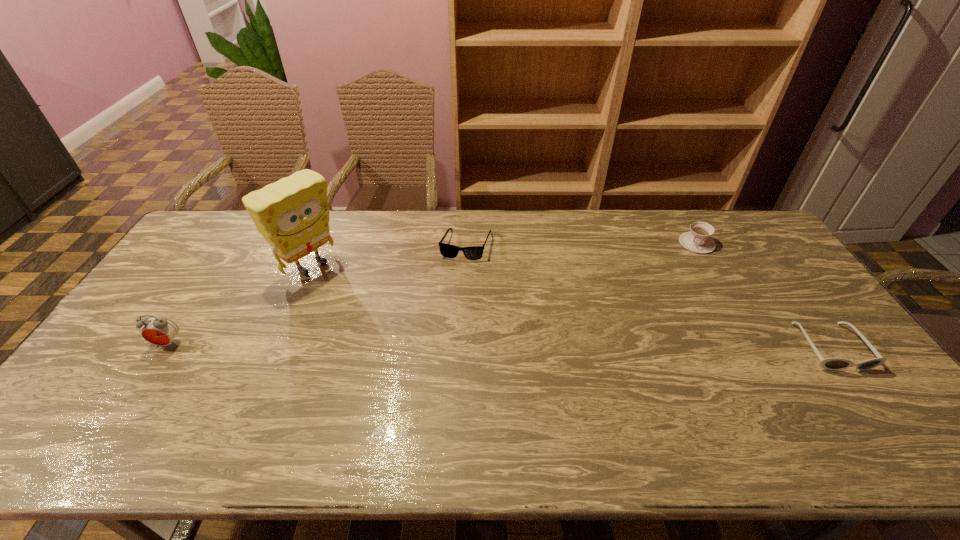
The width and height of the screenshot is (960, 540). I want to click on free space on the desktop that is between the leftmost object and the right sunglasses and is positioned on the front-facing side of the farther sunglasses, so [x=442, y=345].

Where is `vacant space on the desktop that is between the alarm clock and the rightmost object and is positioned on the face of the sponge`? vacant space on the desktop that is between the alarm clock and the rightmost object and is positioned on the face of the sponge is located at coordinates (421, 345).

This screenshot has width=960, height=540. Identify the location of free space on the desktop that is between the second tallest object and the rightmost object and is positioned on the handle side of the fourth object from left to right. (597, 346).